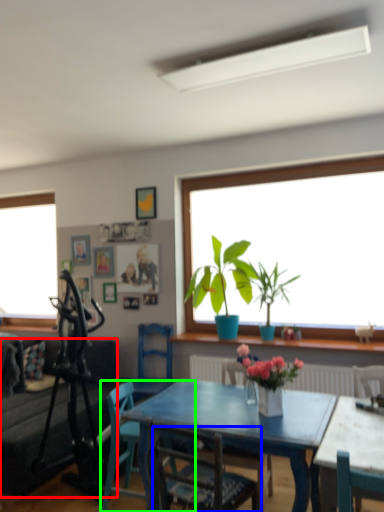
Question: Which object is positioned farthest from studio couch (highlighted by a red box)? Select from chair (highlighted by a blue box) and chair (highlighted by a green box).

Choices:
 (A) chair
 (B) chair

Answer: (A)